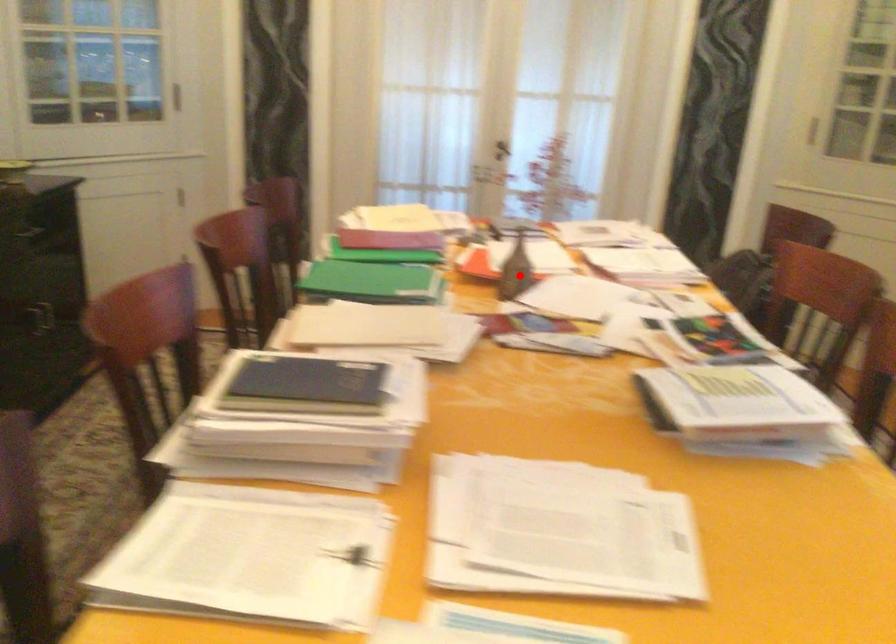
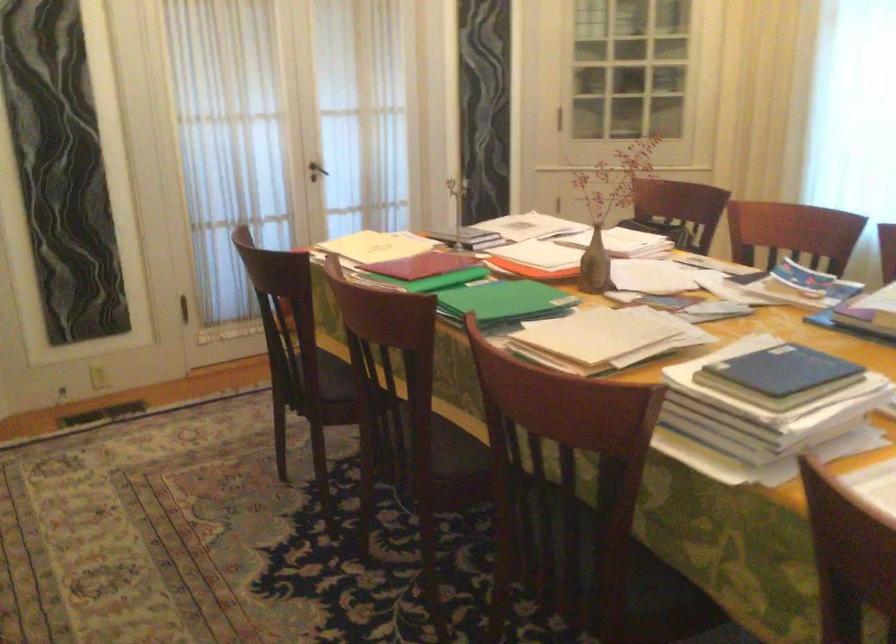
In the second image, find the point that corresponds to the highlighted location in the first image.

(595, 265)